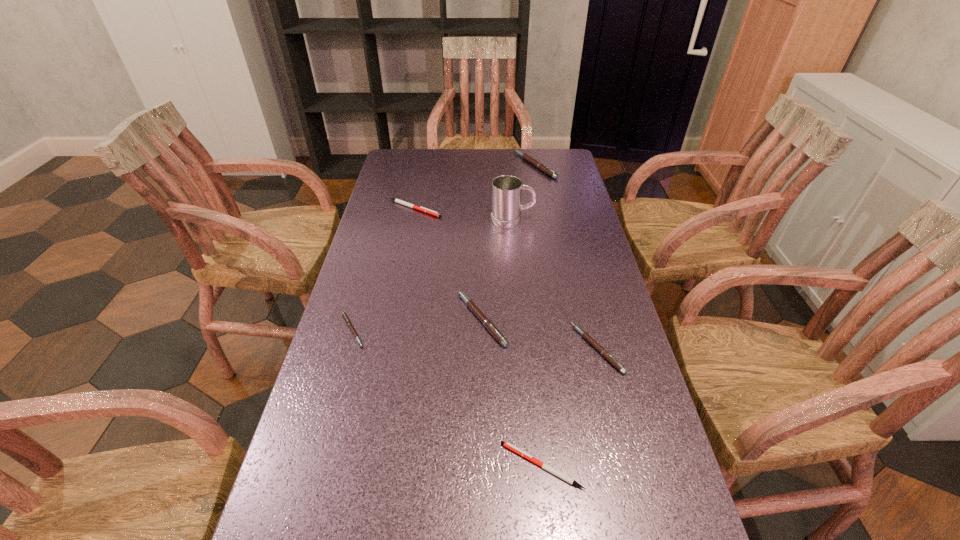
Find the location of `the tallest object`. the tallest object is located at coordinates (506, 190).

Locate an element on the screen. The width and height of the screenshot is (960, 540). gray mug is located at coordinates (506, 190).

Identify the location of the farthest object. (542, 167).

Where is `the farthest pen`? This screenshot has height=540, width=960. the farthest pen is located at coordinates (542, 167).

Where is `the second pink pen from left to right`? This screenshot has height=540, width=960. the second pink pen from left to right is located at coordinates (487, 323).

Where is `the second biggest pink pen`? the second biggest pink pen is located at coordinates (487, 323).

You are a GUI agent. You are given a task and a screenshot of the screen. Output one action in this format:
    pyautogui.click(x=<x>, y=<y>)
    Task: Click on the third biggest pink pen
    Image resolution: width=960 pixels, height=540 pixels.
    Given the screenshot: What is the action you would take?
    pyautogui.click(x=604, y=353)

The width and height of the screenshot is (960, 540). In order to click on the farther white pen in this screenshot , I will do `click(422, 209)`.

Where is `the left white pen`? the left white pen is located at coordinates (422, 209).

The height and width of the screenshot is (540, 960). Find the location of `the leftmost pink pen`. the leftmost pink pen is located at coordinates (347, 320).